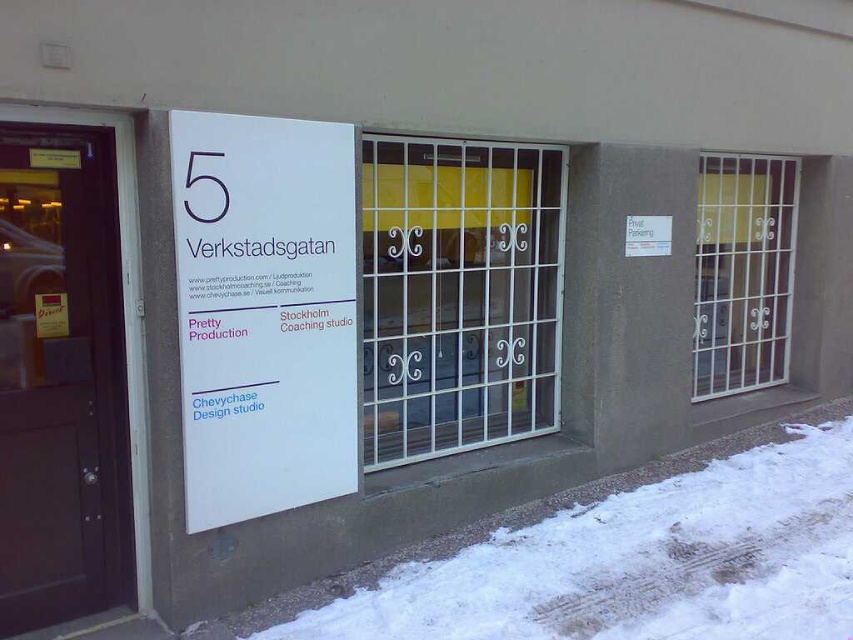
Question: Which is nearer to the white metal gate at center?

Choices:
 (A) white powdery snow at lower right
 (B) brown wooden door at left

Answer: (A)

Question: Which point is farther from the camera taking this photo?

Choices:
 (A) (448, 570)
 (B) (99, 422)
 (C) (287, 138)

Answer: (A)

Question: Is white powdery snow at lower right below brown wooden door at left?

Choices:
 (A) no
 (B) yes

Answer: (B)

Question: Which of the following is the closest to the observer?

Choices:
 (A) white powdery snow at lower right
 (B) brown wooden door at left
 (C) white metal gate at center

Answer: (B)

Question: Does white powdery snow at lower right come in front of white paper sign at center?

Choices:
 (A) yes
 (B) no

Answer: (B)

Question: Does brown wooden door at left have a larger size compared to white metal gate at center?

Choices:
 (A) yes
 (B) no

Answer: (B)